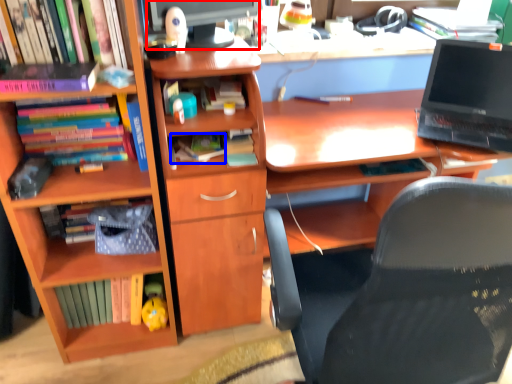
Question: Among these objects, which one is farthest to the camera, computer monitor (highlighted by a red box) or book (highlighted by a blue box)?

Choices:
 (A) computer monitor
 (B) book

Answer: (B)